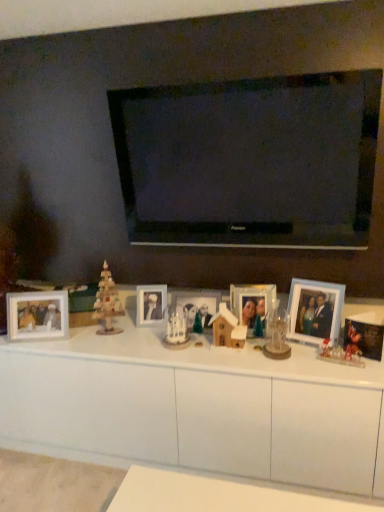
This screenshot has height=512, width=384. I want to click on free space that is to the left of wooden christmas tree at left, so click(x=75, y=337).